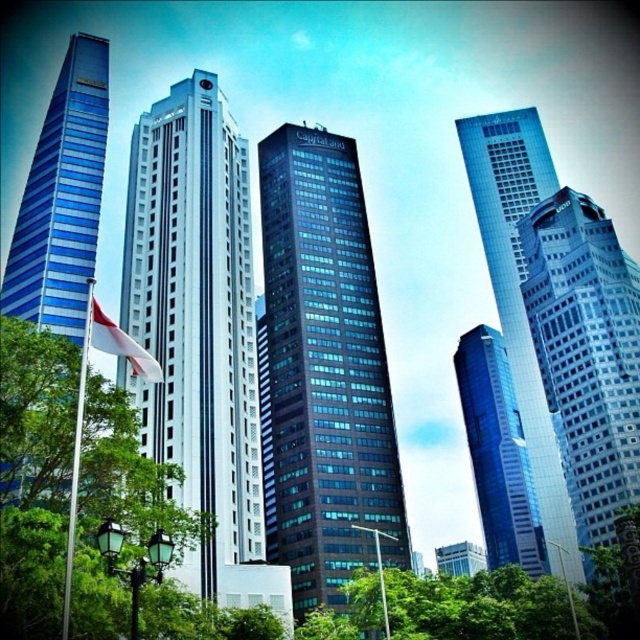
Question: Estimate the real-world distances between objects in this image. Which object is closer to the metallic flag pole at center?

Choices:
 (A) shiny blue glass skyscraper at left
 (B) glassy blue skyscraper at right
 (C) silver metallic flag pole at left

Answer: (C)

Question: Is white glossy building at center below glossy glass skyscraper at upper right?

Choices:
 (A) yes
 (B) no

Answer: (B)

Question: Which of the following is the farthest from the observer?

Choices:
 (A) (582, 317)
 (B) (385, 596)
 (C) (38, 134)

Answer: (C)

Question: Which of the following is the farthest from the observer?

Choices:
 (A) white glossy building at center
 (B) glossy glass skyscraper at upper right
 (C) black glass building at center

Answer: (B)

Question: From the image, what is the correct spatial relationship of glossy glass skyscraper at upper right in relation to silver metallic flag pole at left?

Choices:
 (A) above
 (B) below

Answer: (A)

Question: Is white glossy building at center to the left of metallic flag pole at lower right from the viewer's perspective?

Choices:
 (A) no
 (B) yes

Answer: (B)